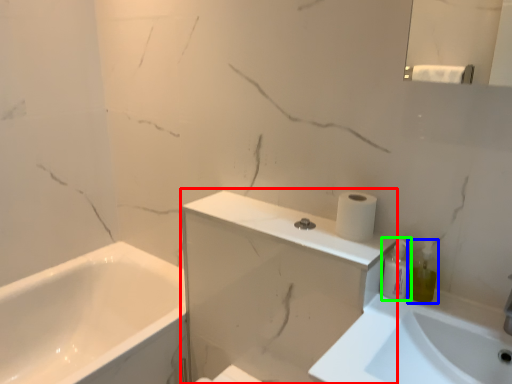
Question: Which is nearer to the medicine cabinet (highlighted by a red box)? soap dispenser (highlighted by a blue box) or toiletry (highlighted by a green box).

Choices:
 (A) soap dispenser
 (B) toiletry

Answer: (B)